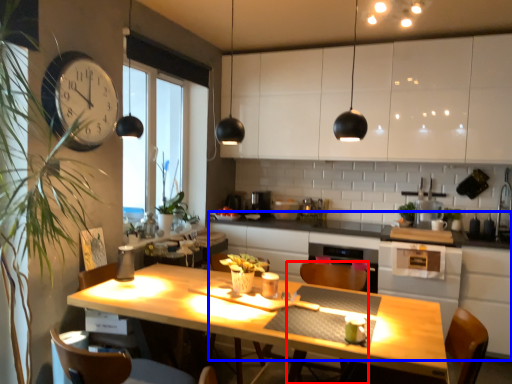
Question: Which object appears farthest to the camera in this image, armchair (highlighted by a red box) or counter (highlighted by a blue box)?

Choices:
 (A) armchair
 (B) counter

Answer: (B)